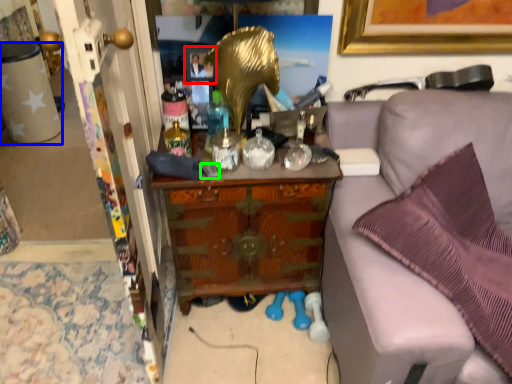
Question: Based on their relative distances, which object is nearer to picture frame (highlighted by a red box)? Choose from desk (highlighted by a blue box) and remote control (highlighted by a green box).

Choices:
 (A) desk
 (B) remote control

Answer: (B)